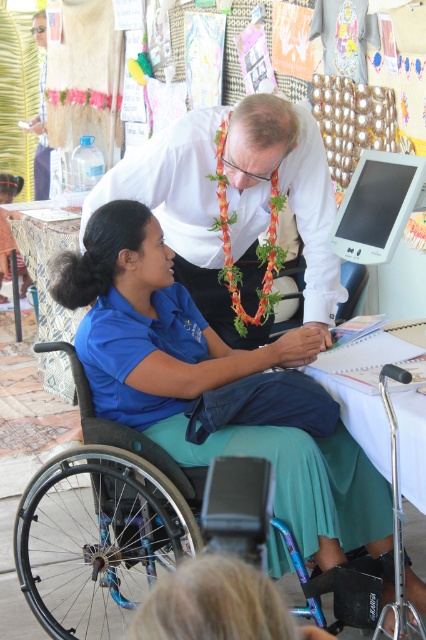
Question: Is black plastic wheelchair at lower left positioned behind matte plastic computer screen at upper right?

Choices:
 (A) no
 (B) yes

Answer: (A)

Question: Among these objects, which one is nearest to the camera?

Choices:
 (A) patterned fabric table at lower left
 (B) matte plastic computer screen at upper right
 (C) white paper at center
 (D) white shirt at center

Answer: (B)

Question: Based on their relative distances, which object is nearer to the white shirt at center?

Choices:
 (A) black plastic wheelchair at lower left
 (B) matte plastic computer screen at upper right
 (C) patterned fabric table at lower left

Answer: (B)

Question: Where is black plastic wheelchair at lower left located in relation to matte plastic computer screen at upper right in the image?

Choices:
 (A) above
 (B) below

Answer: (B)

Question: Which of these objects is positioned farthest from the matte plastic computer screen at upper right?

Choices:
 (A) black plastic wheelchair at lower left
 (B) white paper at center
 (C) patterned fabric table at lower left

Answer: (C)

Question: Can you confirm if matte plastic computer screen at upper right is smaller than white paper at center?

Choices:
 (A) yes
 (B) no

Answer: (A)